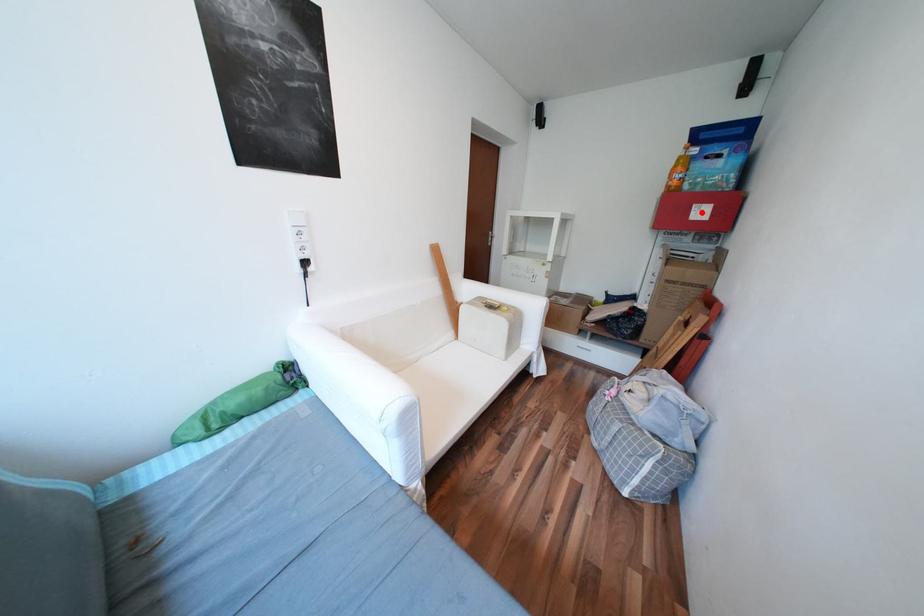
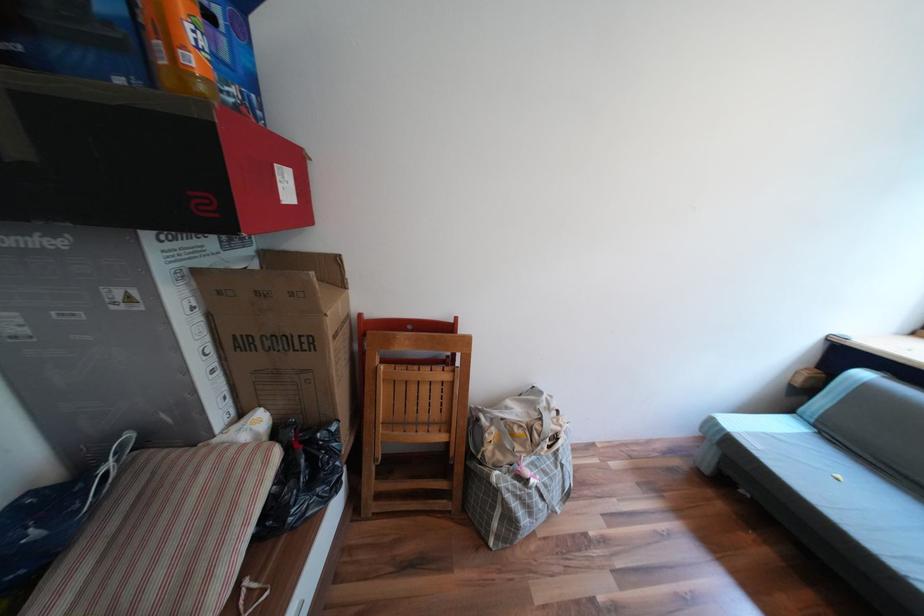
In the second image, find the point that corresponds to the highlighted location in the first image.

(289, 185)